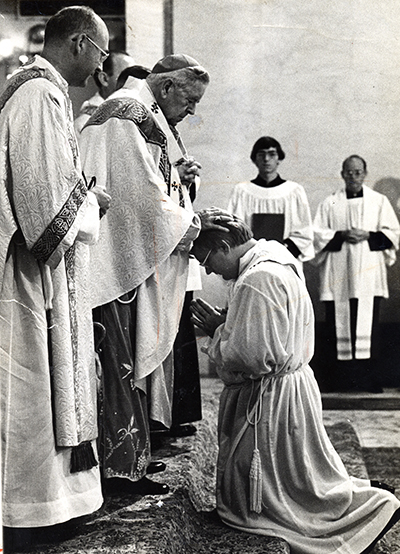
Find the location of `stairs`. stairs is located at coordinates (154, 526), (217, 532), (388, 543).